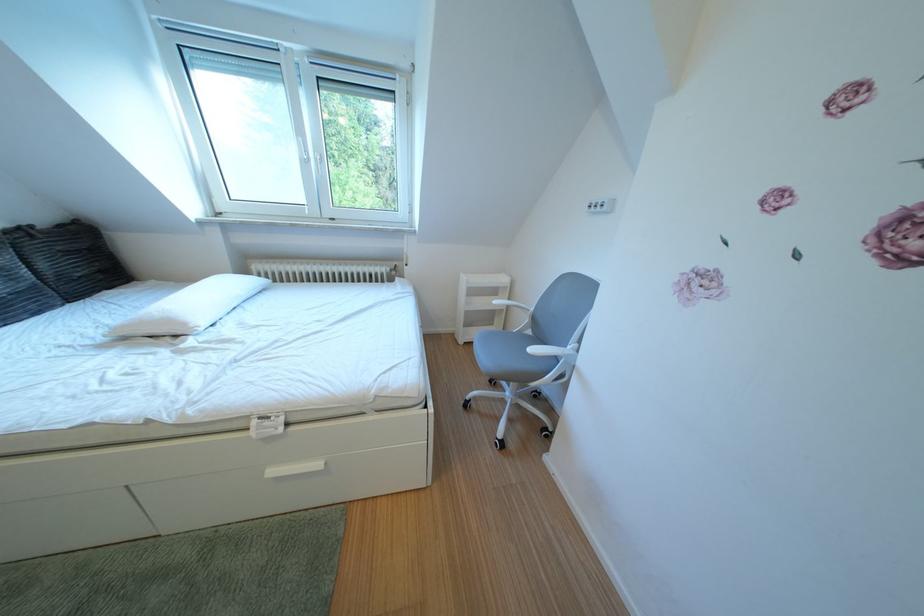
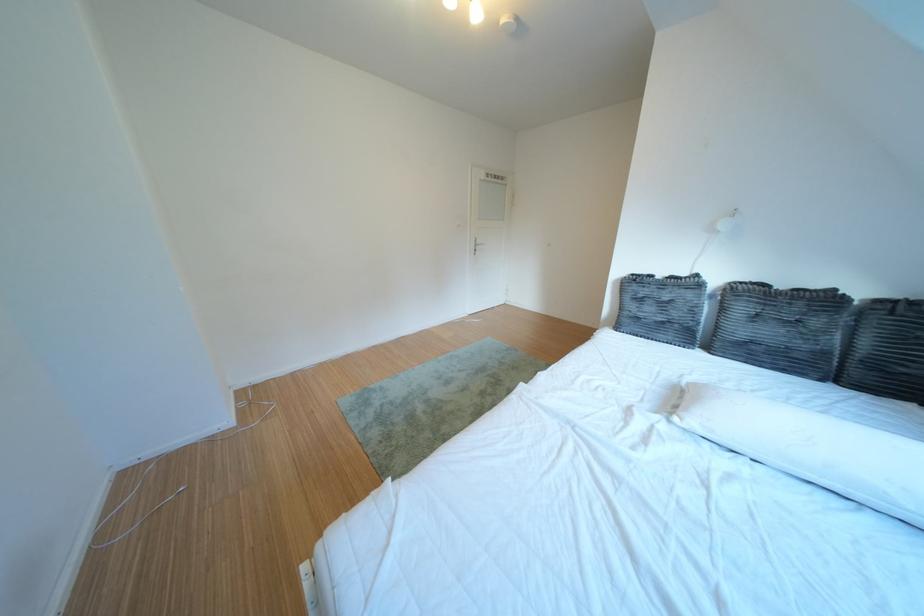
Locate, in the second image, the point that corresponds to (32,233) in the first image.

(910, 306)